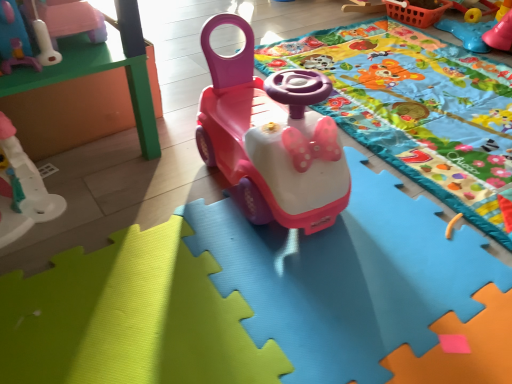
Question: Is rubberized blue steering wheel at upper right, positioned as the fourth toy in left-to-right order, taller or shorter than matte pink toy at upper left, which is the third toy from right to left?

Choices:
 (A) short
 (B) tall

Answer: (B)

Question: From the image's perspective, relative to matte pink toy at upper left, which is the third toy from right to left, is rubberized blue steering wheel at upper right, positioned as the fourth toy in left-to-right order, above or below?

Choices:
 (A) below
 (B) above

Answer: (B)

Question: Which object is the farthest from the matte plastic car at center, the second toy viewed from the right?

Choices:
 (A) matte pink toy at upper left, acting as the 2th toy starting from the left
 (B) green matte table at upper left
 (C) matte plastic blanket at center
 (D) rubberized blue steering wheel at upper right, positioned as the fourth toy in left-to-right order
 (E) orange plastic basket at upper right

Answer: (E)

Question: Which of these objects is positioned closest to the matte plastic blanket at center?

Choices:
 (A) green matte table at upper left
 (B) white plastic toy at left, which is the 1th toy from left to right
 (C) matte plastic car at center, the second toy viewed from the right
 (D) orange plastic basket at upper right
 (E) matte pink toy at upper left, acting as the 2th toy starting from the left

Answer: (C)